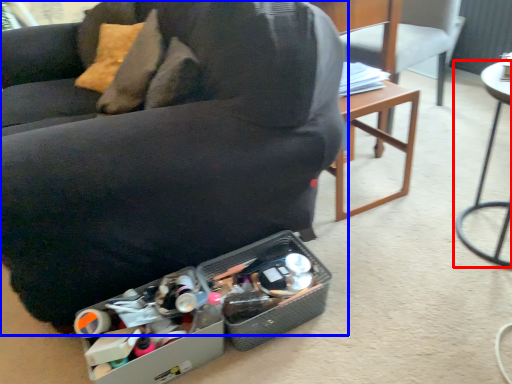
Question: Which object appears closest to the camera in this image, table (highlighted by a red box) or chair (highlighted by a blue box)?

Choices:
 (A) table
 (B) chair

Answer: (B)